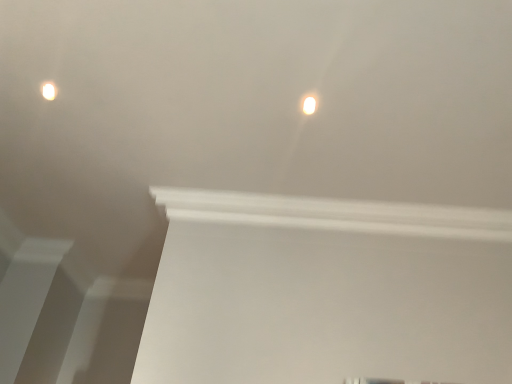
Question: Is white glossy light fixture at upper center, which is the second lamp in back-to-front order, bigger or smaller than matte white light fixture at upper left, the second lamp positioned from the front?

Choices:
 (A) big
 (B) small

Answer: (B)

Question: In terms of width, does white glossy light fixture at upper center, the 1th lamp in the front-to-back sequence, look wider or thinner when compared to matte white light fixture at upper left, the second lamp positioned from the front?

Choices:
 (A) wide
 (B) thin

Answer: (A)

Question: From the image's perspective, is white glossy light fixture at upper center, arranged as the second lamp when viewed from the top, positioned above or below matte white light fixture at upper left, which ranks as the first lamp in back-to-front order?

Choices:
 (A) above
 (B) below

Answer: (B)

Question: Is matte white light fixture at upper left, which ranks as the first lamp in back-to-front order, to the left or to the right of white glossy light fixture at upper center, positioned as the first lamp in bottom-to-top order, in the image?

Choices:
 (A) left
 (B) right

Answer: (A)

Question: From a real-world perspective, relative to white glossy light fixture at upper center, positioned as the first lamp in bottom-to-top order, is matte white light fixture at upper left, the second lamp positioned from the front, vertically above or below?

Choices:
 (A) below
 (B) above

Answer: (B)

Question: Relative to white glossy light fixture at upper center, marked as the second lamp in a left-to-right arrangement, is matte white light fixture at upper left, acting as the 1th lamp starting from the top, in front or behind?

Choices:
 (A) front
 (B) behind

Answer: (B)

Question: Which is correct: matte white light fixture at upper left, the second lamp viewed from the right, is inside white glossy light fixture at upper center, positioned as the first lamp in bottom-to-top order, or outside of it?

Choices:
 (A) outside
 (B) inside

Answer: (A)